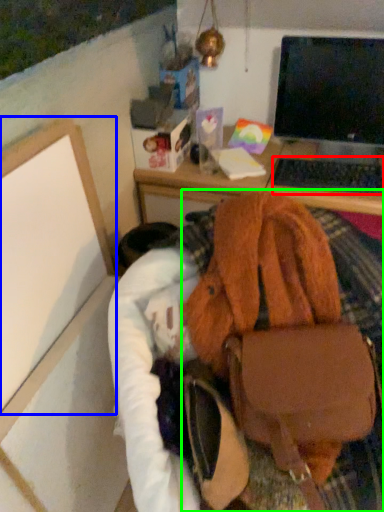
Question: Considering the real-world distances, which object is closest to computer keyboard (highlighted by a red box)? bulletin board (highlighted by a blue box) or handbag (highlighted by a green box).

Choices:
 (A) bulletin board
 (B) handbag

Answer: (B)